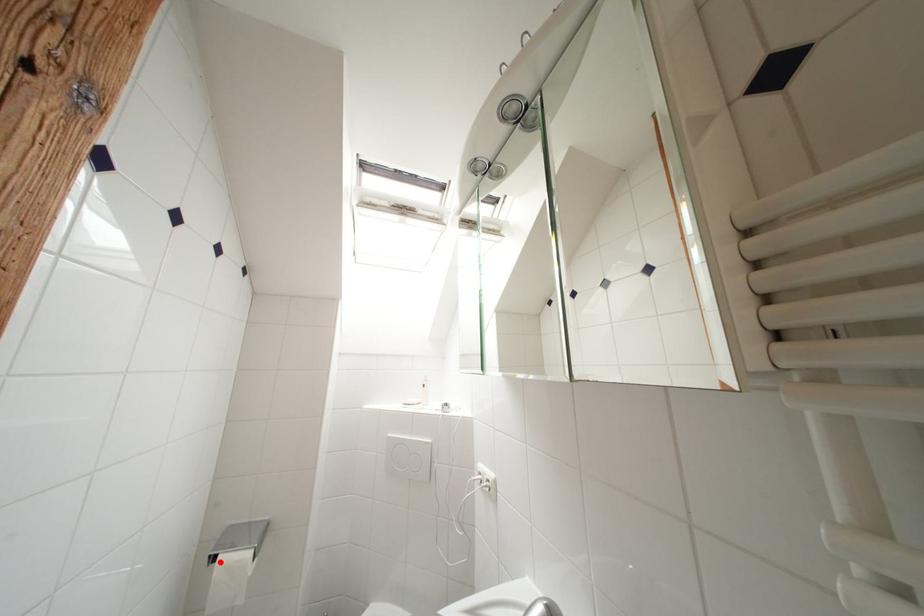
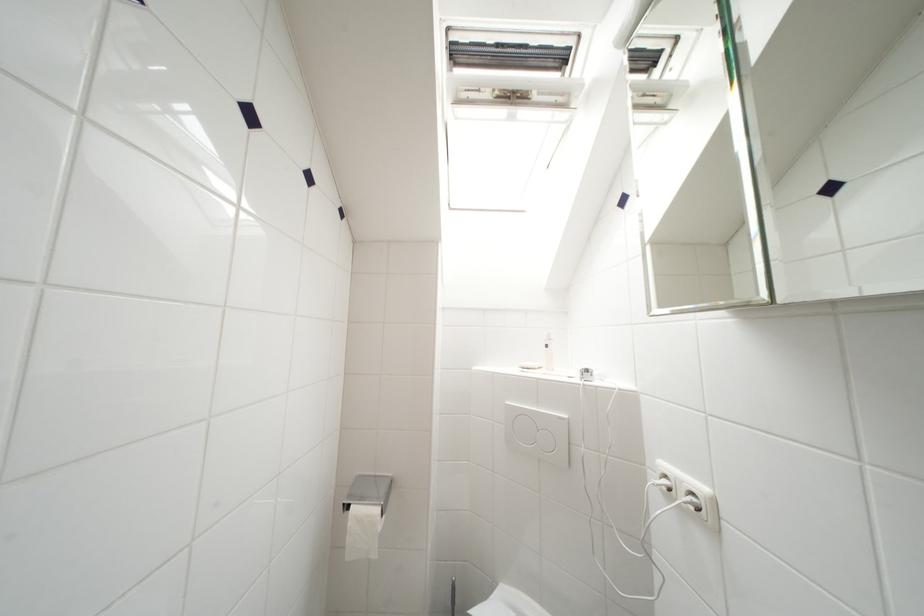
Find the pixel in the second image that matches the highlighted location in the first image.

(354, 512)